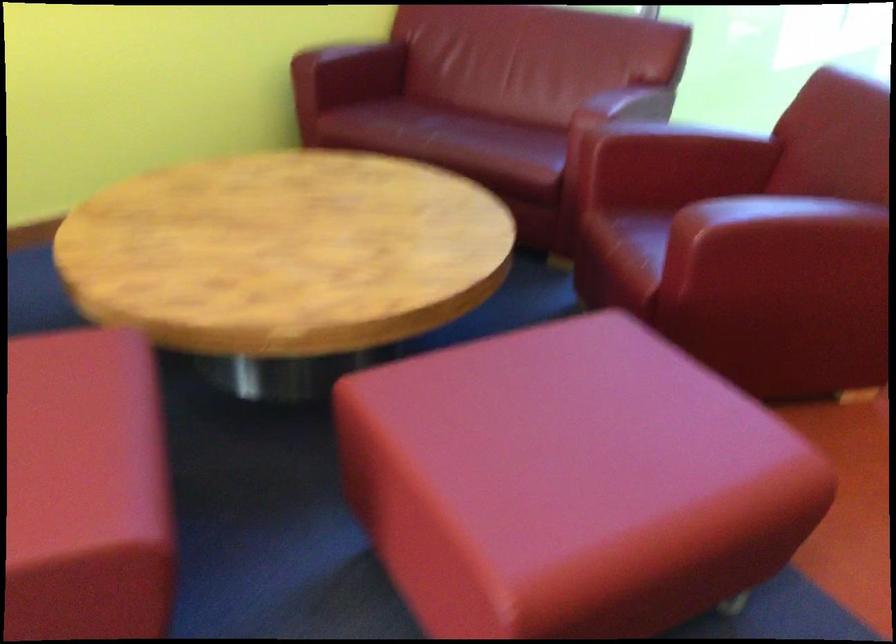
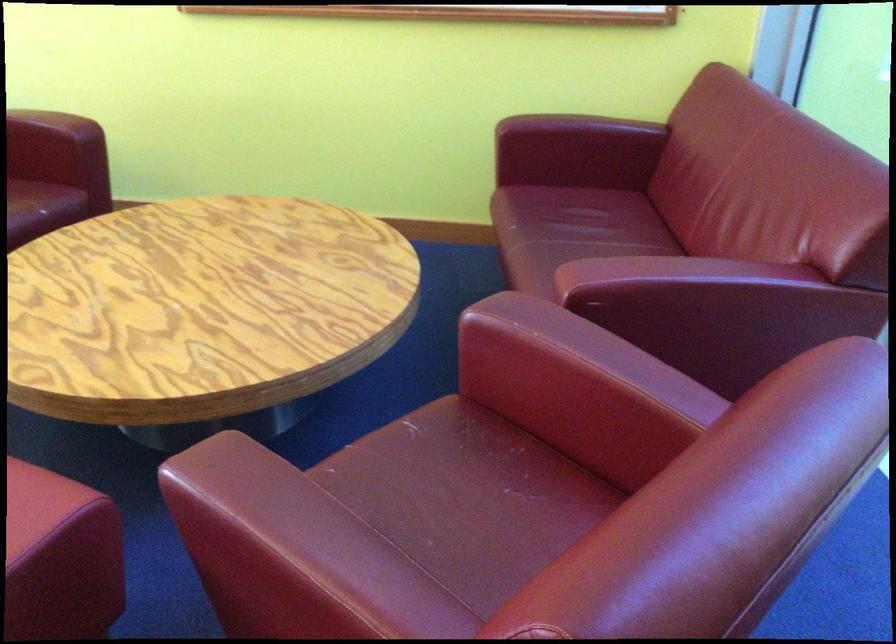
Locate, in the second image, the point that corresponds to point (797, 232) in the first image.

(261, 542)